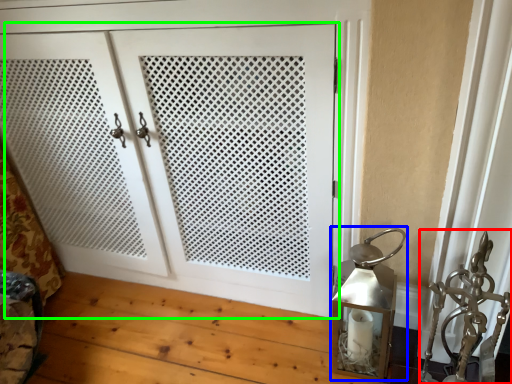
Question: Based on their relative distances, which object is farther from sculpture (highlighted by a red box)? Choose from table lamp (highlighted by a blue box) and door (highlighted by a green box).

Choices:
 (A) table lamp
 (B) door

Answer: (B)